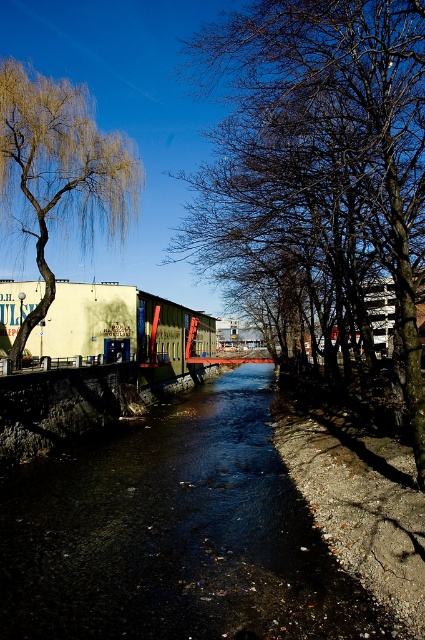
You are a photographer planning to capture the canal scene. You want to ensure both the black smooth water at center and the golden textured willow at upper left are clearly visible in your shot. Based on their spatial relationship, which object should you prioritize framing first to ensure it doesn

The golden textured willow at upper left occupies more space than the black smooth water at center, so you should prioritize framing the golden textured willow at upper left first to ensure it is fully captured in the shot.

You are an urban planner assessing the canal area. You need to determine which tree structure occupies more space in the scene. Which one is larger between the bare branches at center and the golden textured willow at upper left?

The bare branches at center is bigger than the golden textured willow at upper left, so the bare branches at center occupies more space in the scene.

You are standing at the edge of the canal and want to reach the bare branches at center. Which direction should you walk to get closer to them?

The bare branches at center are located at point coordinates, so you should walk towards the center of the canal to reach them.